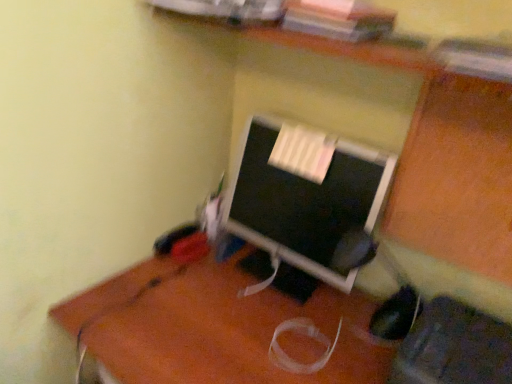
Question: Is brown wooden desk at center next to matte black monitor at center and touching it?

Choices:
 (A) no
 (B) yes

Answer: (A)

Question: Can you confirm if brown wooden desk at center is wider than matte black monitor at center?

Choices:
 (A) no
 (B) yes

Answer: (B)

Question: Is brown wooden desk at center facing towards matte black monitor at center?

Choices:
 (A) yes
 (B) no

Answer: (B)

Question: Is brown wooden desk at center located outside matte black monitor at center?

Choices:
 (A) no
 (B) yes

Answer: (B)

Question: Is brown wooden desk at center behind matte black monitor at center?

Choices:
 (A) no
 (B) yes

Answer: (A)

Question: From their relative heights in the image, would you say matte black monitor at center is taller or shorter than brown wooden desk at center?

Choices:
 (A) short
 (B) tall

Answer: (A)

Question: From a real-world perspective, relative to brown wooden desk at center, is matte black monitor at center vertically above or below?

Choices:
 (A) below
 (B) above

Answer: (B)

Question: From the image's perspective, is matte black monitor at center positioned above or below brown wooden desk at center?

Choices:
 (A) above
 (B) below

Answer: (A)

Question: Looking at the image, does matte black monitor at center seem bigger or smaller compared to brown wooden desk at center?

Choices:
 (A) small
 (B) big

Answer: (A)

Question: Does point (88, 307) appear closer or farther from the camera than point (446, 339)?

Choices:
 (A) farther
 (B) closer

Answer: (A)

Question: In terms of height, does brown wooden desk at center look taller or shorter compared to black fabric computer chair at lower right?

Choices:
 (A) short
 (B) tall

Answer: (B)

Question: In the image, is brown wooden desk at center positioned in front of or behind black fabric computer chair at lower right?

Choices:
 (A) front
 (B) behind

Answer: (B)

Question: Is brown wooden desk at center wider or thinner than black fabric computer chair at lower right?

Choices:
 (A) wide
 (B) thin

Answer: (A)

Question: Is black fabric computer chair at lower right spatially inside brown wooden desk at center, or outside of it?

Choices:
 (A) outside
 (B) inside

Answer: (A)

Question: Looking at their shapes, would you say black fabric computer chair at lower right is wider or thinner than brown wooden desk at center?

Choices:
 (A) thin
 (B) wide

Answer: (A)